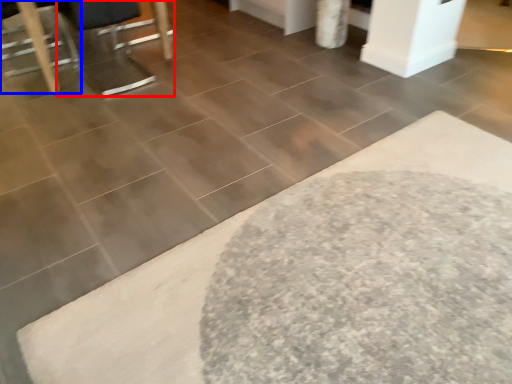
Question: Which object is closer to the camera taking this photo, swivel chair (highlighted by a red box) or furniture (highlighted by a blue box)?

Choices:
 (A) swivel chair
 (B) furniture

Answer: (A)